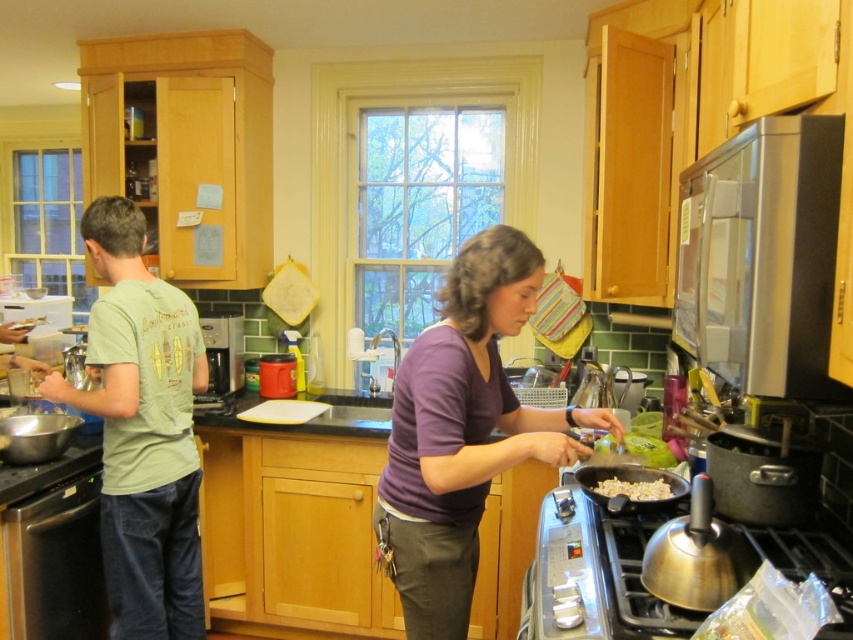
You are standing in the kitchen and need to reach the purple matte shirt at center. Which direction should you move relative to your current position?

The purple matte shirt at center is located at point 0.675 on the x and 0.544 on the y axis. Since the coordinate system starts at the bottom left corner, moving towards the right and slightly upwards would help you reach it.

Consider the image. You are a chef in this kitchen and need to reach the stainless steel stove at lower right. There is a purple matte shirt at center in the way. Can you move around it to access the stove?

The purple matte shirt at center is above the stainless steel stove at lower right, so you can move around it by going to the sides since it is positioned above and not blocking the path.